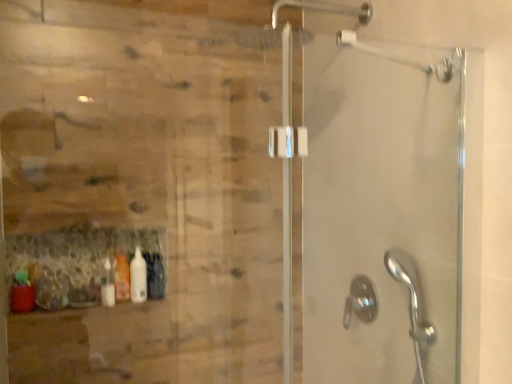
Question: Are satin nickel showerhead at lower right and matte red bottle at lower left, acting as the 3th bottle starting from the back, beside each other?

Choices:
 (A) no
 (B) yes

Answer: (A)

Question: Would you say satin nickel showerhead at lower right is outside matte red bottle at lower left, the first bottle in the left-to-right sequence?

Choices:
 (A) no
 (B) yes

Answer: (B)

Question: From the image's perspective, is satin nickel showerhead at lower right below matte red bottle at lower left, the third bottle viewed from the right?

Choices:
 (A) yes
 (B) no

Answer: (A)

Question: Considering the relative sizes of satin nickel showerhead at lower right and matte red bottle at lower left, the first bottle in the left-to-right sequence, in the image provided, is satin nickel showerhead at lower right smaller than matte red bottle at lower left, the first bottle in the left-to-right sequence,?

Choices:
 (A) yes
 (B) no

Answer: (B)

Question: Is satin nickel showerhead at lower right not near matte red bottle at lower left, acting as the 3th bottle starting from the back?

Choices:
 (A) no
 (B) yes

Answer: (B)

Question: Is satin nickel showerhead at lower right facing away from matte red bottle at lower left, the first bottle from the front?

Choices:
 (A) no
 (B) yes

Answer: (A)

Question: Does translucent plastic bottle at lower left, which appears as the first bottle when viewed from the back, appear on the right side of matte red bottle at lower left, the third bottle viewed from the right?

Choices:
 (A) yes
 (B) no

Answer: (A)

Question: Considering the relative sizes of translucent plastic bottle at lower left, which appears as the first bottle when viewed from the back, and matte red bottle at lower left, the first bottle from the front, in the image provided, is translucent plastic bottle at lower left, which appears as the first bottle when viewed from the back, wider than matte red bottle at lower left, the first bottle from the front,?

Choices:
 (A) no
 (B) yes

Answer: (A)

Question: Are translucent plastic bottle at lower left, the second bottle when ordered from left to right, and matte red bottle at lower left, the first bottle from the front, far apart?

Choices:
 (A) yes
 (B) no

Answer: (B)

Question: Considering the relative sizes of translucent plastic bottle at lower left, the third bottle in the front-to-back sequence, and matte red bottle at lower left, acting as the 3th bottle starting from the back, in the image provided, is translucent plastic bottle at lower left, the third bottle in the front-to-back sequence, smaller than matte red bottle at lower left, acting as the 3th bottle starting from the back,?

Choices:
 (A) yes
 (B) no

Answer: (A)

Question: Considering the relative sizes of translucent plastic bottle at lower left, the third bottle in the front-to-back sequence, and matte red bottle at lower left, the third bottle viewed from the right, in the image provided, is translucent plastic bottle at lower left, the third bottle in the front-to-back sequence, bigger than matte red bottle at lower left, the third bottle viewed from the right,?

Choices:
 (A) no
 (B) yes

Answer: (A)

Question: Does translucent plastic bottle at lower left, the second bottle when ordered from left to right, have a lesser height compared to matte red bottle at lower left, acting as the 3th bottle starting from the back?

Choices:
 (A) no
 (B) yes

Answer: (A)

Question: Is matte red bottle at lower left, the first bottle from the front, smaller than translucent plastic bottle at lower left, the second bottle when ordered from left to right?

Choices:
 (A) yes
 (B) no

Answer: (B)